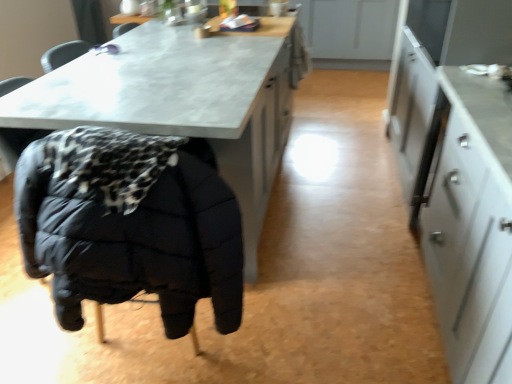
What is the approximate height of white glossy cabinet at right?

35.28 inches.

The image size is (512, 384). Describe the element at coordinates (185, 100) in the screenshot. I see `matte gray table at center` at that location.

You are a GUI agent. You are given a task and a screenshot of the screen. Output one action in this format:
    pyautogui.click(x=<x>, y=<y>)
    Task: Click on the white glossy cabinet at right
    Image resolution: width=512 pixels, height=384 pixels.
    Given the screenshot: What is the action you would take?
    pyautogui.click(x=459, y=171)

Looking at this image, measure the distance from black quilted jacket at lower left to white glossy cabinet at right.

black quilted jacket at lower left is 3.57 feet from white glossy cabinet at right.

From the image's perspective, is black quilted jacket at lower left located above or below white glossy cabinet at right?

Clearly, from the image's perspective, black quilted jacket at lower left is above white glossy cabinet at right.

Would you say black quilted jacket at lower left is outside white glossy cabinet at right?

Indeed, black quilted jacket at lower left is completely outside white glossy cabinet at right.

Does black quilted jacket at lower left have a greater width compared to white glossy cabinet at right?

Yes.

Is matte gray table at center far away from white glossy cabinet at right?

No, matte gray table at center is in close proximity to white glossy cabinet at right.

Between matte gray table at center and white glossy cabinet at right, which one is positioned in front?

white glossy cabinet at right is closer to the camera.

Who is shorter, matte gray table at center or white glossy cabinet at right?

white glossy cabinet at right is shorter.

What are the coordinates of `cabinetry that appears on the right of matte gray table at center` in the screenshot? It's located at (459, 171).

Considering the relative sizes of matte gray table at center and black quilted jacket at lower left in the image provided, is matte gray table at center shorter than black quilted jacket at lower left?

No, matte gray table at center is not shorter than black quilted jacket at lower left.

The width and height of the screenshot is (512, 384). In order to click on jacket below the matte gray table at center (from the image's perspective) in this screenshot , I will do `click(129, 225)`.

Considering the positions of points (203, 73) and (114, 184), is point (203, 73) closer to camera compared to point (114, 184)?

No, it is behind (114, 184).

Which object is positioned more to the left, white glossy cabinet at right or black quilted jacket at lower left?

From the viewer's perspective, black quilted jacket at lower left appears more on the left side.

Is the position of white glossy cabinet at right more distant than that of black quilted jacket at lower left?

That is False.

Considering the relative sizes of white glossy cabinet at right and black quilted jacket at lower left in the image provided, is white glossy cabinet at right bigger than black quilted jacket at lower left?

Yes, white glossy cabinet at right is bigger than black quilted jacket at lower left.

From the picture: Does black quilted jacket at lower left have a greater height compared to matte gray table at center?

Incorrect, the height of black quilted jacket at lower left is not larger of that of matte gray table at center.

Does black quilted jacket at lower left have a larger size compared to matte gray table at center?

No.

Considering the relative sizes of black quilted jacket at lower left and matte gray table at center in the image provided, is black quilted jacket at lower left thinner than matte gray table at center?

Correct, the width of black quilted jacket at lower left is less than that of matte gray table at center.

Is white glossy cabinet at right turned away from matte gray table at center?

That's not correct — white glossy cabinet at right is not looking away from matte gray table at center.

From their relative heights in the image, would you say white glossy cabinet at right is taller or shorter than matte gray table at center?

In the image, white glossy cabinet at right appears to be shorter than matte gray table at center.

From the image's perspective, which object appears higher, white glossy cabinet at right or matte gray table at center?

matte gray table at center appears higher in the image.

Locate an element on the screen. The width and height of the screenshot is (512, 384). cabinetry directly beneath the black quilted jacket at lower left (from a real-world perspective) is located at coordinates (459, 171).

The width and height of the screenshot is (512, 384). I want to click on table above the white glossy cabinet at right (from a real-world perspective), so click(x=185, y=100).

Based on their spatial positions, is black quilted jacket at lower left or matte gray table at center further from white glossy cabinet at right?

The object further to white glossy cabinet at right is black quilted jacket at lower left.

Based on their spatial positions, is black quilted jacket at lower left or white glossy cabinet at right further from matte gray table at center?

The object further to matte gray table at center is white glossy cabinet at right.

Considering their positions, is white glossy cabinet at right positioned further to black quilted jacket at lower left than matte gray table at center?

white glossy cabinet at right is further to black quilted jacket at lower left.

Looking at the image, which one is located closer to white glossy cabinet at right, matte gray table at center or black quilted jacket at lower left?

matte gray table at center.

From the image, which object appears to be farther from black quilted jacket at lower left, matte gray table at center or white glossy cabinet at right?

white glossy cabinet at right.

Looking at the image, which one is located closer to matte gray table at center, white glossy cabinet at right or black quilted jacket at lower left?

black quilted jacket at lower left is positioned closer to the anchor matte gray table at center.

This screenshot has height=384, width=512. I want to click on table between black quilted jacket at lower left and white glossy cabinet at right from left to right, so click(185, 100).